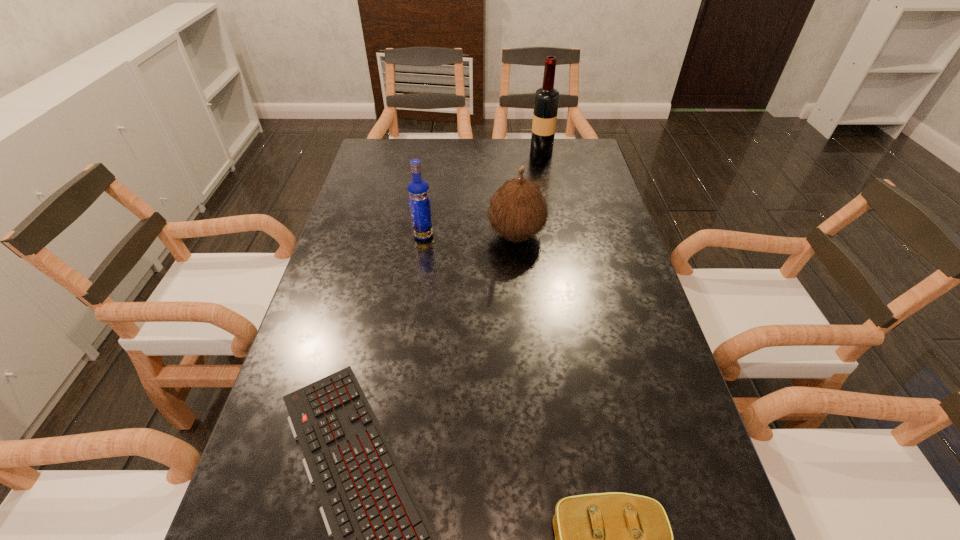
At what (x,y) coordinates should I click in order to perform the action: click on object present at the right edge. Please return your answer as a coordinate pair (x, y). The height and width of the screenshot is (540, 960). Looking at the image, I should click on (546, 101).

Identify the location of object that is at the far right corner. (546, 101).

In the image, there is a desktop. Identify the location of blank space at the far edge. (439, 163).

Where is `vacant position at the left edge of the desktop`? vacant position at the left edge of the desktop is located at coordinates (292, 512).

Find the location of a particular element. The height and width of the screenshot is (540, 960). free space at the right edge of the desktop is located at coordinates (636, 396).

Find the location of a particular element. The height and width of the screenshot is (540, 960). free space at the far right corner of the desktop is located at coordinates (573, 146).

At what (x,y) coordinates should I click in order to perform the action: click on free spot between the vodka and the wine bottle. Please return your answer as a coordinate pair (x, y). The width and height of the screenshot is (960, 540). Looking at the image, I should click on (482, 194).

You are a GUI agent. You are given a task and a screenshot of the screen. Output one action in this format:
    pyautogui.click(x=<x>, y=<y>)
    Task: Click on the vacant space that's between the coconut and the vodka
    
    Given the screenshot: What is the action you would take?
    pyautogui.click(x=469, y=235)

I want to click on vacant area between the wine bottle and the vodka, so click(x=482, y=194).

I want to click on free space that is in between the coconut and the vodka, so click(x=469, y=235).